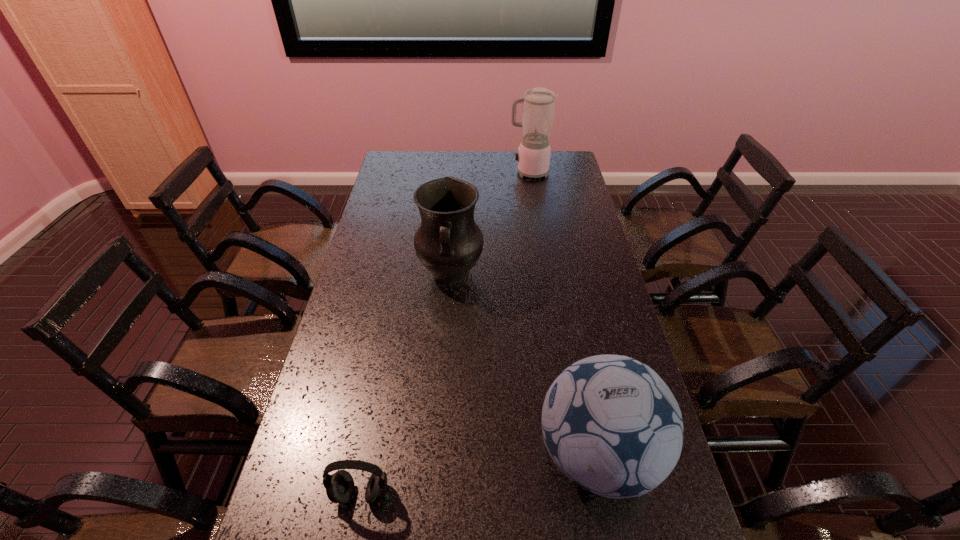
In the image, there is a desktop. Identify the location of free space at the far left corner. (407, 170).

This screenshot has width=960, height=540. Identify the location of vacant space at the far right corner of the desktop. (569, 177).

Image resolution: width=960 pixels, height=540 pixels. I want to click on empty location between the farthest object and the headset, so click(x=444, y=333).

Locate an element on the screen. This screenshot has height=540, width=960. free space between the headset and the pitcher is located at coordinates (406, 383).

What are the coordinates of `vacant space in between the soccer ball and the farthest object` in the screenshot? It's located at (564, 314).

Locate an element on the screen. vacant area that lies between the second farthest object and the food processor is located at coordinates (490, 223).

Find the location of `blank region between the shortest object and the soccer ball`. blank region between the shortest object and the soccer ball is located at coordinates (479, 474).

The height and width of the screenshot is (540, 960). In order to click on vacant point located between the shortest object and the farthest object in this screenshot , I will do tap(444, 333).

Find the location of `vacant area between the soccer ball and the tallest object`. vacant area between the soccer ball and the tallest object is located at coordinates (564, 314).

Locate an element on the screen. This screenshot has height=540, width=960. vacant space that's between the tallest object and the third nearest object is located at coordinates (490, 223).